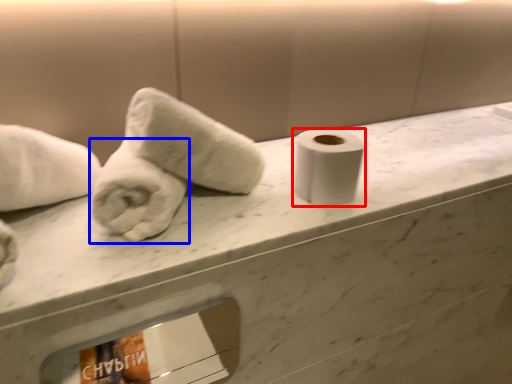
Question: Which object appears farthest to the camera in this image, toilet paper (highlighted by a red box) or towel (highlighted by a blue box)?

Choices:
 (A) toilet paper
 (B) towel

Answer: (A)